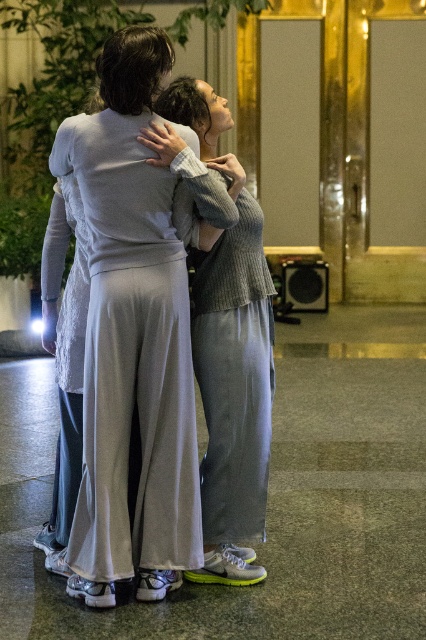
Question: Is light gray knit sweater at center positioned at the back of knitted gray sweater at center?

Choices:
 (A) no
 (B) yes

Answer: (A)

Question: Which point is farther to the camera?

Choices:
 (A) (204, 132)
 (B) (77, 552)

Answer: (A)

Question: Can you confirm if light gray knit sweater at center is positioned to the right of knitted gray sweater at center?

Choices:
 (A) no
 (B) yes

Answer: (A)

Question: Which of the following is the closest to the observer?

Choices:
 (A) light gray knit sweater at center
 (B) knitted gray sweater at center

Answer: (A)

Question: Does light gray knit sweater at center have a larger size compared to knitted gray sweater at center?

Choices:
 (A) yes
 (B) no

Answer: (A)

Question: Among these objects, which one is nearest to the camera?

Choices:
 (A) light gray knit sweater at center
 (B) knitted gray sweater at center

Answer: (A)